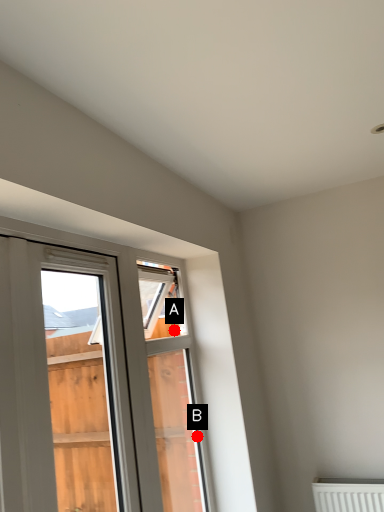
Question: Two points are circled on the image, labeled by A and B beside each circle. Among these points, which one is farthest from the camera?

Choices:
 (A) A is further
 (B) B is further

Answer: (A)